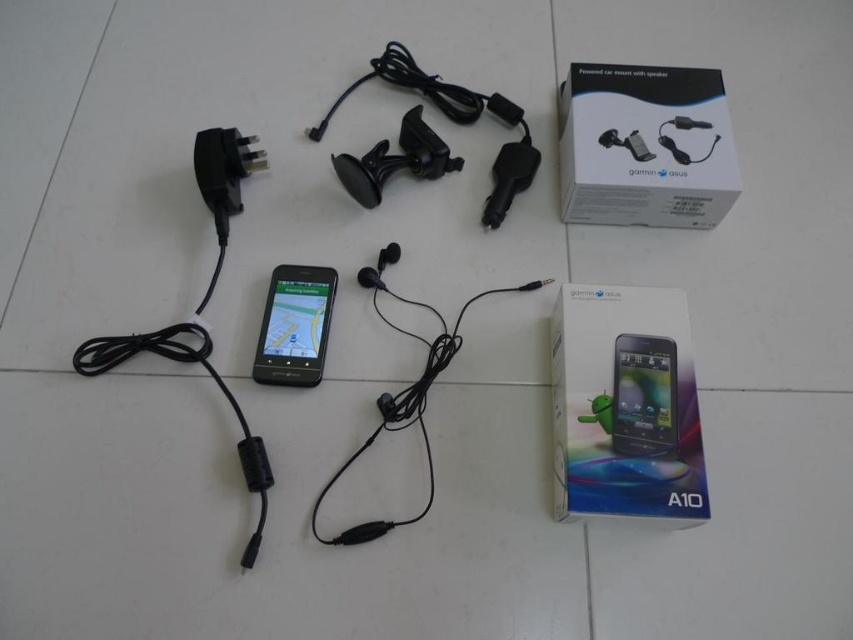
Please provide the exact coordinates of the white matte box at upper right in the image?

The white matte box at upper right is located at coordinates point (645, 147).

You are holding a smartphone and want to place it on the white tiled surface so that it is exactly 1 meter away from the point marked at coordinates point (665,156). Is this possible given the current setup?

The point marked at coordinates point (665,156) is 1.24 meters away from the viewer. Since the smartphone is currently connected to a cable, moving it to be exactly 1 meter away may depend on cable length. If the cable is long enough, yes, but the description does not specify cable length. However, the existing distance is 1.24m, so adjusting to 1m is possible if feasible.

You are setting up a display for a tech store and need to arrange the black glossy phone at center and the matte black phone at center based on their sizes. Which phone should you place on the larger shelf space?

The black glossy phone at center is larger than the matte black phone at center, so it should be placed on the larger shelf space.